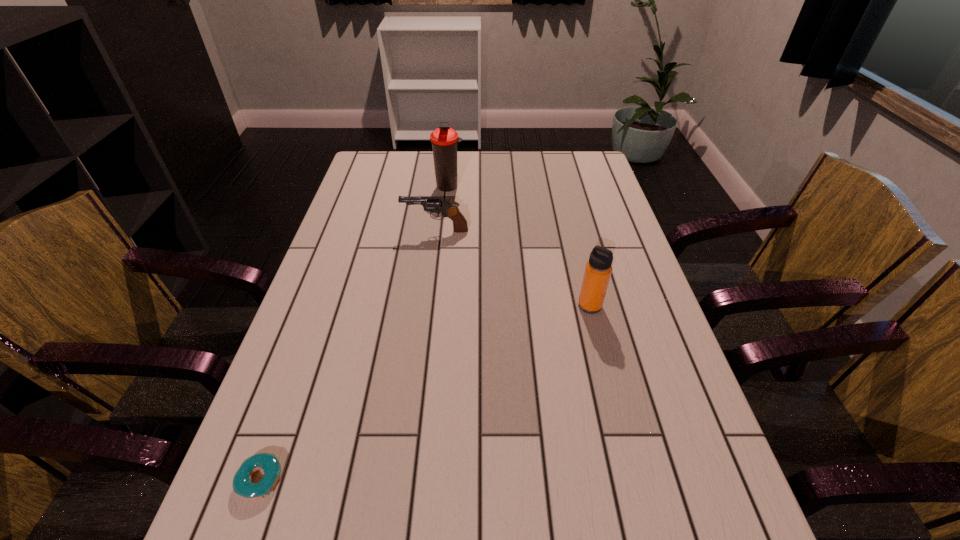
Identify the location of the left thermos bottle. The image size is (960, 540). (444, 140).

The height and width of the screenshot is (540, 960). Find the location of `the farthest object`. the farthest object is located at coordinates (444, 140).

At what (x,y) coordinates should I click in order to perform the action: click on the second nearest object. Please return your answer as a coordinate pair (x, y). This screenshot has height=540, width=960. Looking at the image, I should click on (598, 269).

Locate an element on the screen. The image size is (960, 540). the third shortest object is located at coordinates (598, 269).

Where is `the third nearest object`? The width and height of the screenshot is (960, 540). the third nearest object is located at coordinates (437, 204).

At what (x,y) coordinates should I click in order to perform the action: click on the third tallest object. Please return your answer as a coordinate pair (x, y). Looking at the image, I should click on (437, 204).

Where is `the shortest object`? The image size is (960, 540). the shortest object is located at coordinates (269, 463).

Where is `the nearest object`? The height and width of the screenshot is (540, 960). the nearest object is located at coordinates (269, 463).

The width and height of the screenshot is (960, 540). I want to click on free spot located on the front of the left thermos bottle, so (441, 270).

This screenshot has width=960, height=540. Find the location of `free space located 0.140m on the left of the second tallest object`. free space located 0.140m on the left of the second tallest object is located at coordinates (522, 306).